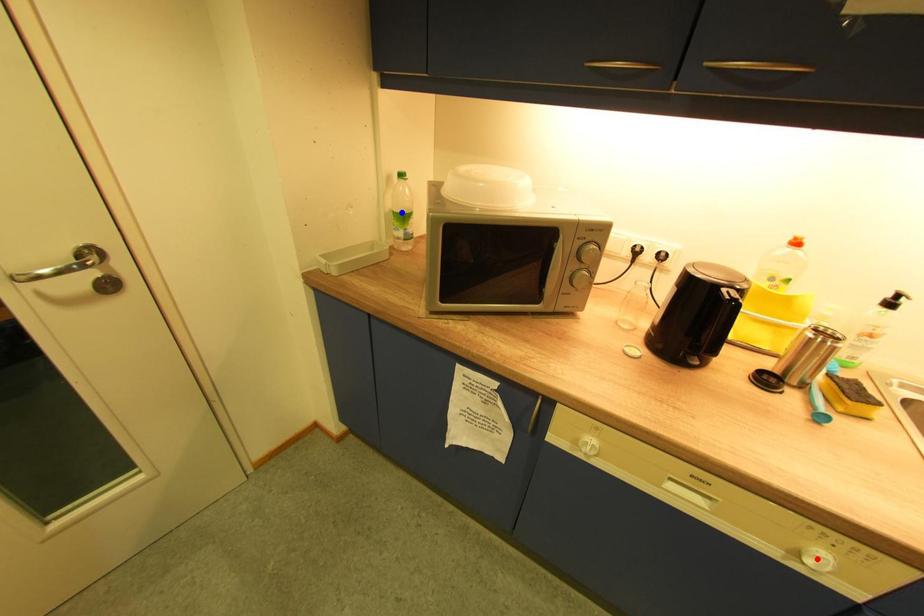
Question: Two points are marked on the image. Which point is closer to the camera?

Choices:
 (A) Blue point is closer.
 (B) Red point is closer.

Answer: (B)